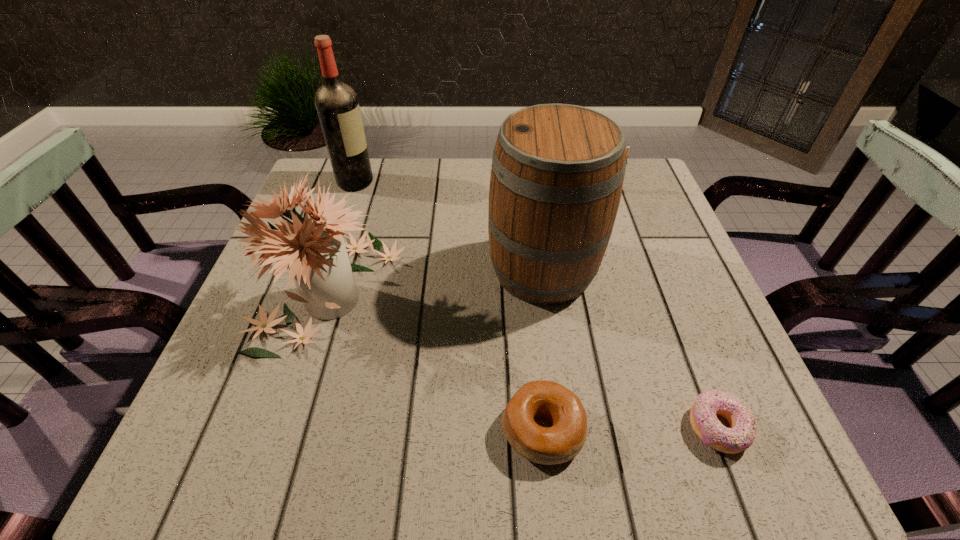
What are the coordinates of `liquor` in the screenshot? It's located at (337, 105).

Image resolution: width=960 pixels, height=540 pixels. In order to click on cider in this screenshot , I will do `click(557, 174)`.

I want to click on bouquet, so click(315, 253).

You are a GUI agent. You are given a task and a screenshot of the screen. Output one action in this format:
    pyautogui.click(x=<x>, y=<y>)
    Task: Click on the candle
    The width and height of the screenshot is (960, 540).
    Given the screenshot: What is the action you would take?
    pyautogui.click(x=627, y=148)

Locate an element on the screen. The height and width of the screenshot is (540, 960). bagel is located at coordinates (560, 443).

Locate an element on the screen. The image size is (960, 540). the shortest object is located at coordinates (x=742, y=432).

The image size is (960, 540). In order to click on free space located on the front-facing side of the liquor in this screenshot , I will do `click(411, 182)`.

Identify the location of vacant space located on the front of the cider. (556, 366).

At what (x,y) coordinates should I click in order to perform the action: click on vacant area situated 0.150m on the back of the bouquet. Please return your answer as a coordinate pair (x, y). This screenshot has height=540, width=960. Looking at the image, I should click on (360, 195).

Locate an element on the screen. The width and height of the screenshot is (960, 540). vacant space located 0.210m on the left of the third shortest object is located at coordinates (495, 188).